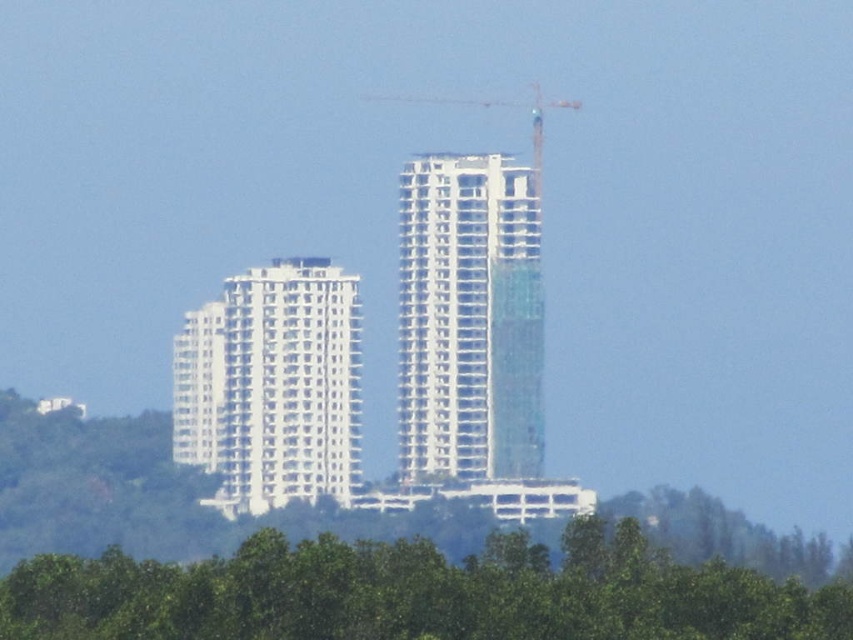
Does point (682, 600) come closer to viewer compared to point (241, 342)?

No, (682, 600) is further to viewer.

At what (x,y) coordinates should I click in order to perform the action: click on green leafy trees at lower center. Please return your answer as a coordinate pair (x, y). Looking at the image, I should click on (416, 593).

Is green leafy trees at lower center in front of white glassy building at center?

No, green leafy trees at lower center is behind white glassy building at center.

Is point (485, 602) in front of point (538, 468)?

No, it is behind (538, 468).

Does point (715, 593) come farther from viewer compared to point (412, 282)?

That is True.

Where is `green leafy trees at lower center`? The width and height of the screenshot is (853, 640). green leafy trees at lower center is located at coordinates (416, 593).

Between white glassy building at center and white metallic crane at center, which one has less height?

Standing shorter between the two is white metallic crane at center.

Who is positioned more to the right, white glassy building at center or white metallic crane at center?

white metallic crane at center is more to the right.

Does point (448, 168) come closer to viewer compared to point (374, 96)?

Yes, point (448, 168) is in front of point (374, 96).

Identify the location of white glassy building at center. This screenshot has width=853, height=640. (469, 320).